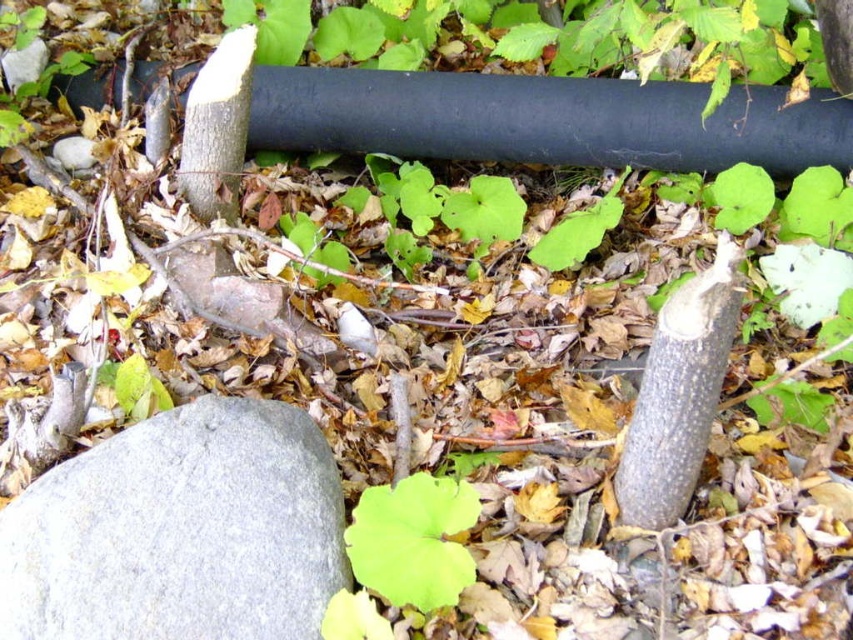
Can you confirm if gray rough rock at lower left is wider than green matte leaf at center?

Yes, gray rough rock at lower left is wider than green matte leaf at center.

Is point (260, 518) less distant than point (442, 496)?

Yes, it is in front of point (442, 496).

Image resolution: width=853 pixels, height=640 pixels. Describe the element at coordinates (180, 531) in the screenshot. I see `gray rough rock at lower left` at that location.

Locate an element on the screen. Image resolution: width=853 pixels, height=640 pixels. gray rough rock at lower left is located at coordinates (180, 531).